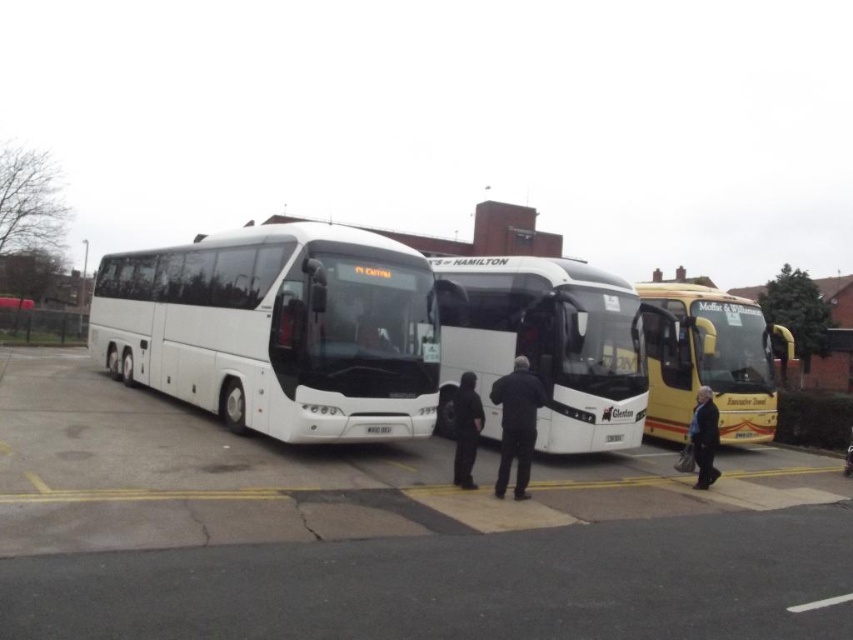
Which of these two, white glossy bus at center or yellow matte bus at right, stands taller?

Standing taller between the two is yellow matte bus at right.

Who is positioned more to the left, white glossy bus at center or yellow matte bus at right?

From the viewer's perspective, white glossy bus at center appears more on the left side.

Between point (108, 456) and point (767, 348), which one is positioned in front?

Positioned in front is point (108, 456).

This screenshot has width=853, height=640. What are the coordinates of `white glossy bus at center` in the screenshot? It's located at (386, 532).

Is white glossy bus at center closer to camera compared to dark blue jacket at lower right?

That is True.

Identify the location of white glossy bus at center. (386, 532).

Does white glossy bus at left lie in front of yellow matte bus at right?

Yes, white glossy bus at left is closer to the viewer.

Looking at this image, does white glossy bus at left appear under yellow matte bus at right?

No, white glossy bus at left is not below yellow matte bus at right.

Where is `white glossy bus at left`? white glossy bus at left is located at coordinates (277, 330).